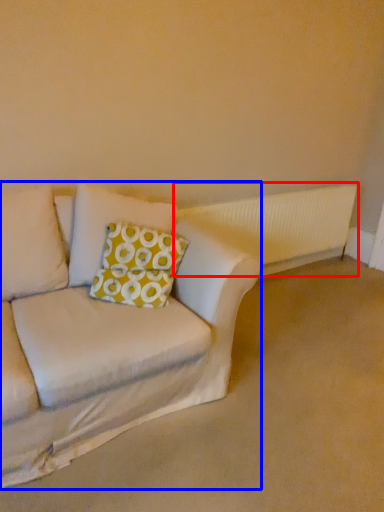
Question: Which object is further to the camera taking this photo, radiator (highlighted by a red box) or studio couch (highlighted by a blue box)?

Choices:
 (A) radiator
 (B) studio couch

Answer: (A)